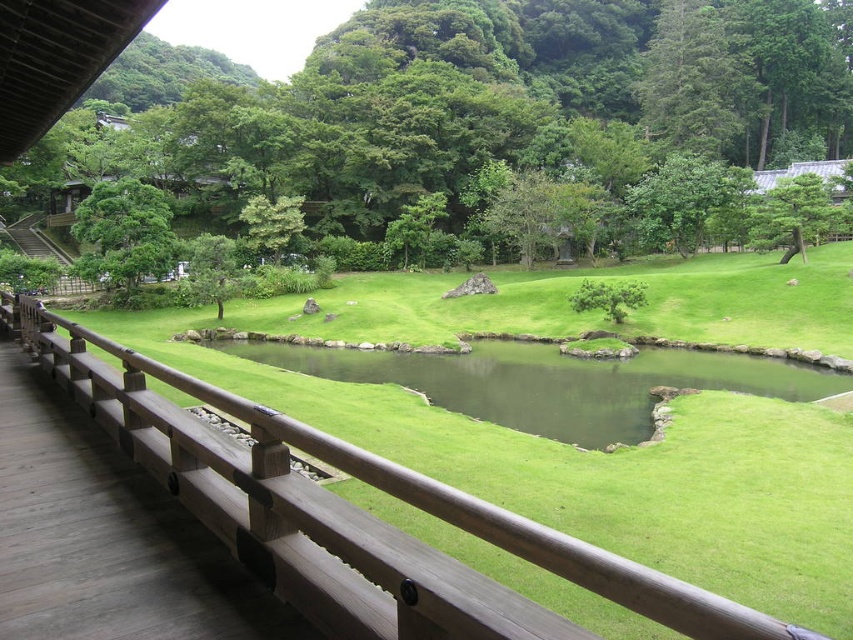
Question: Does green leafy tree at center appear under brown wooden rail at left?

Choices:
 (A) no
 (B) yes

Answer: (A)

Question: Is green leafy tree at upper left bigger than green textured pine tree at upper right?

Choices:
 (A) yes
 (B) no

Answer: (A)

Question: Among these objects, which one is farthest from the camera?

Choices:
 (A) green leafy tree at upper left
 (B) green leafy tree at center
 (C) brown wooden rail at left
 (D) green textured pine tree at upper right

Answer: (A)

Question: Is brown wooden rail at left in front of green textured pine tree at upper right?

Choices:
 (A) no
 (B) yes

Answer: (B)

Question: Among these points, which one is nearest to the camera?

Choices:
 (A) (820, 202)
 (B) (236, 346)

Answer: (B)

Question: Estimate the real-world distances between objects in this image. Which object is farther from the green leafy tree at center?

Choices:
 (A) green water at center
 (B) brown wooden rail at left
 (C) green textured pine tree at upper right
 (D) green leafy tree at upper left

Answer: (B)